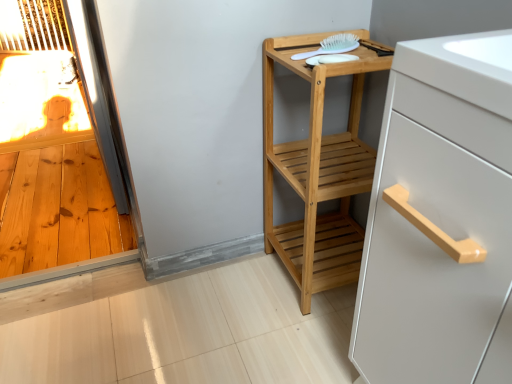
Where is `free space to the back side of white plastic brush at upper right`? free space to the back side of white plastic brush at upper right is located at coordinates point(317,42).